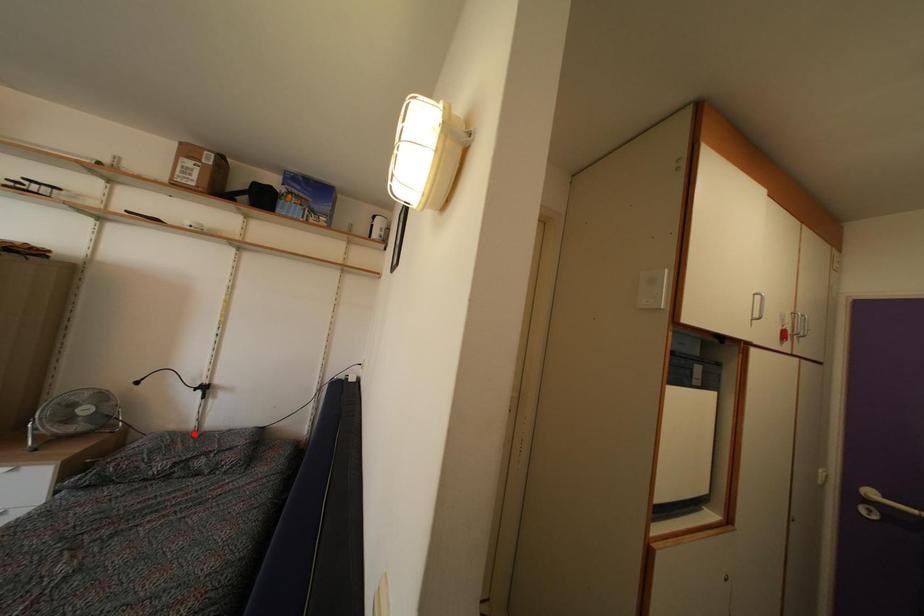
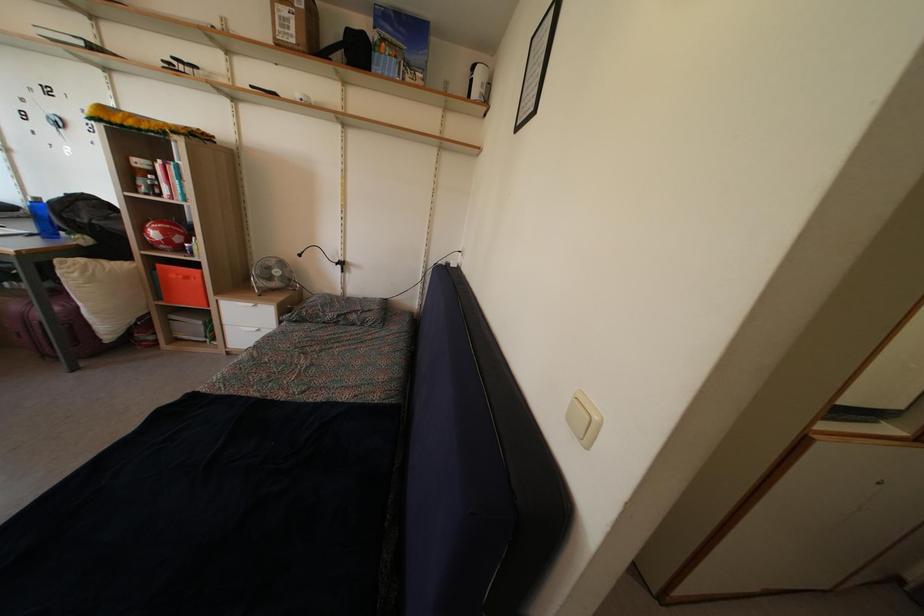
In the second image, find the point that corresponds to the highlighted location in the first image.

(342, 301)